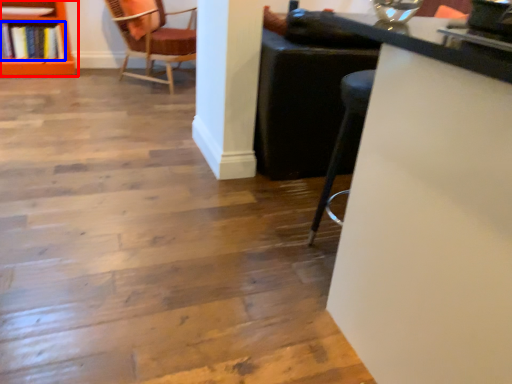
Question: Among these objects, which one is farthest to the camera, shelf (highlighted by a red box) or book (highlighted by a blue box)?

Choices:
 (A) shelf
 (B) book

Answer: (B)